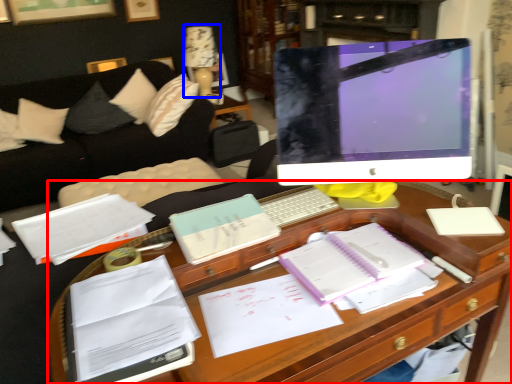
Question: Which of the following is the closest to the observer, desk (highlighted by a red box) or table lamp (highlighted by a blue box)?

Choices:
 (A) desk
 (B) table lamp

Answer: (A)